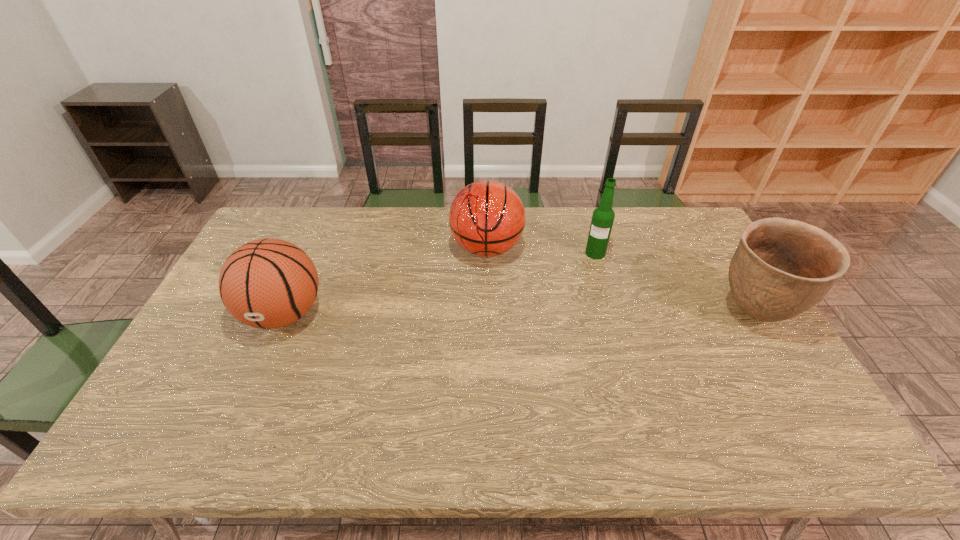
Where is `the nearer basketball`? The height and width of the screenshot is (540, 960). the nearer basketball is located at coordinates (267, 283).

Image resolution: width=960 pixels, height=540 pixels. I want to click on the leftmost object, so click(267, 283).

Where is `pottery`? This screenshot has height=540, width=960. pottery is located at coordinates (781, 268).

Locate an element on the screen. This screenshot has width=960, height=540. the second object from right to left is located at coordinates (603, 216).

At what (x,y) coordinates should I click in order to perform the action: click on the farther basketball. Please return your answer as a coordinate pair (x, y). Looking at the image, I should click on (487, 218).

Image resolution: width=960 pixels, height=540 pixels. I want to click on the third object from right to left, so click(x=487, y=218).

You are a GUI agent. You are given a task and a screenshot of the screen. Output one action in this format:
    pyautogui.click(x=<x>, y=<y>)
    Task: Click on the vacant space located 0.070m on the side where the inflation valve is located
    The image size is (960, 540).
    Given the screenshot: What is the action you would take?
    pyautogui.click(x=259, y=370)

The height and width of the screenshot is (540, 960). I want to click on vacant space located 0.280m on the left of the rightmost object, so click(617, 314).

The width and height of the screenshot is (960, 540). I want to click on vacant area situated 0.070m on the label of the beer bottle, so click(591, 273).

Where is `vacant position located on the label of the beer bottle`? The width and height of the screenshot is (960, 540). vacant position located on the label of the beer bottle is located at coordinates (586, 301).